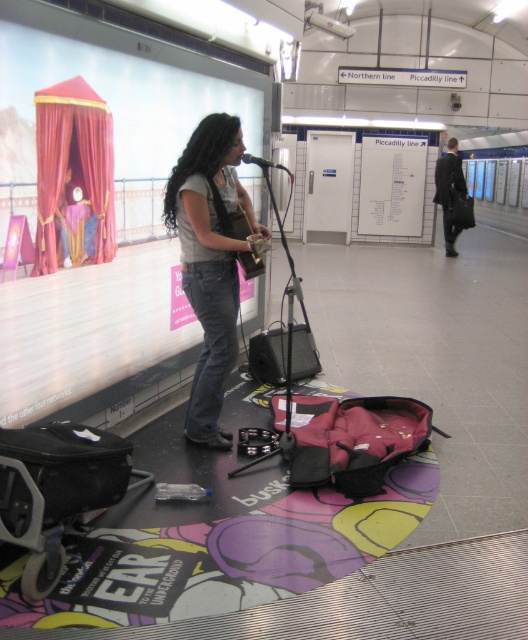
Between matte gray shirt at center and wooden acoustic guitar at center, which one has less height?

wooden acoustic guitar at center is shorter.

Who is lower down, matte gray shirt at center or wooden acoustic guitar at center?

matte gray shirt at center is below.

In order to click on matte gray shirt at center in this screenshot , I will do `click(211, 260)`.

Is dark suit at right above black metallic microphone at center?

Correct, dark suit at right is located above black metallic microphone at center.

Is dark suit at right wider than black metallic microphone at center?

Correct, the width of dark suit at right exceeds that of black metallic microphone at center.

Between point (458, 170) and point (260, 163), which one is positioned behind?

The point (458, 170) is behind.

Identify the location of dark suit at right. (449, 193).

Is dark suit at right positioned in front of wooden acoustic guitar at center?

No.

Is dark suit at right wider than wooden acoustic guitar at center?

Correct, the width of dark suit at right exceeds that of wooden acoustic guitar at center.

Does point (452, 141) come in front of point (253, 260)?

No, it is behind (253, 260).

In order to click on dark suit at right in this screenshot , I will do `click(449, 193)`.